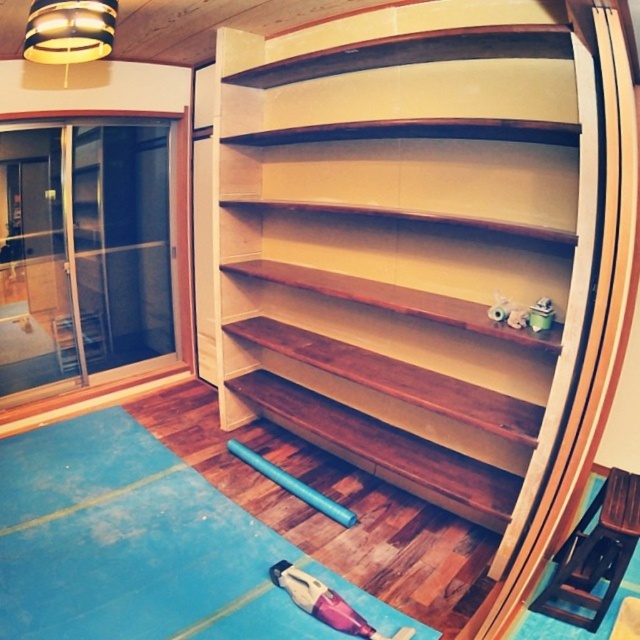
You are standing in the room and want to place a new plant pot on the floor near the blue rubber mat at lower center. However, you need to ensure that the plant pot won not block the view of the wooden shelves at center. Can you place the plant pot there?

The wooden shelves at center is closer to the viewer than the blue rubber mat at lower center. Placing the plant pot near the blue rubber mat at lower center would not block the view of the wooden shelves at center since the shelves are closer to you.

Where are the wooden shelves at center located in the image?

The wooden shelves at center are located at point (433, 253).

You are standing in the interior space with the curved shelving unit on the right and the sliding glass door on the left. You want to move from point A to point B. If point A is at coordinates point (620, 252) and point B is at coordinates point (154, 550), will you pass in front of point B before reaching it?

Point (620, 252) is in front of point (154, 550), so moving from point A to point B, you would first pass in front of point B before reaching it.